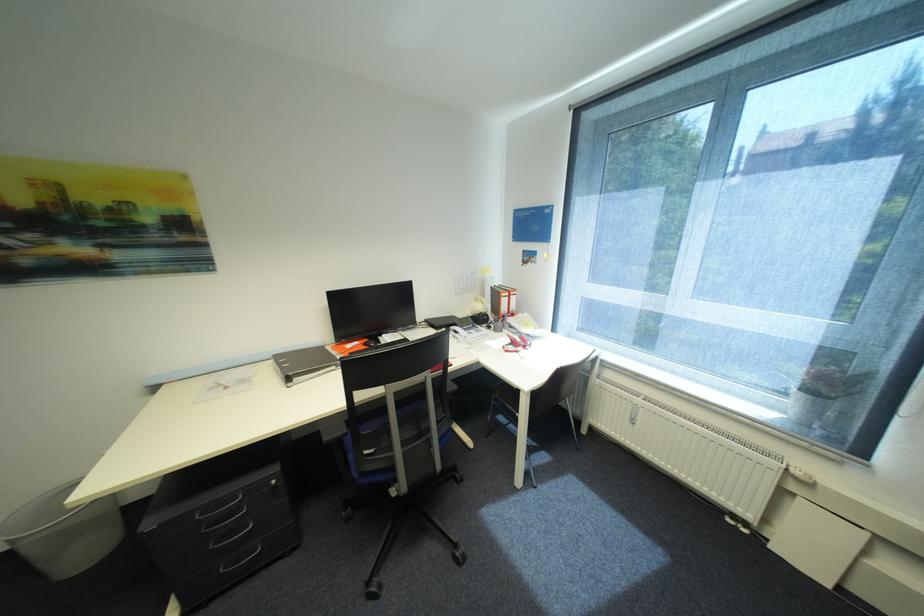
Find where to sit the blue chair sitting surface. Please return your answer as a coordinate pair (x, y).

(409, 419)